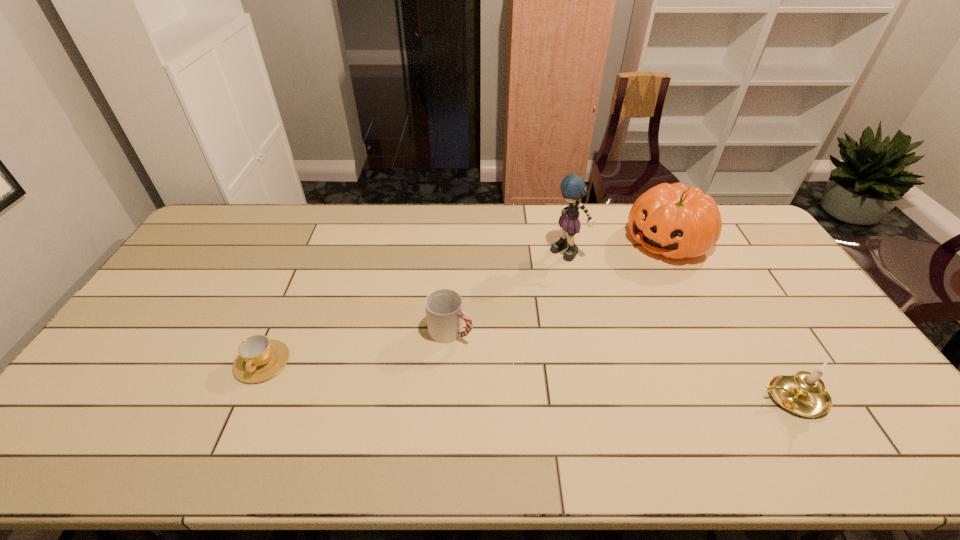
Where is `vacant area at the near right corner of the desktop`? vacant area at the near right corner of the desktop is located at coordinates (833, 395).

Locate an element on the screen. vacant region between the third tallest object and the tallest object is located at coordinates (x=680, y=326).

The height and width of the screenshot is (540, 960). I want to click on vacant region between the fourth tallest object and the third tallest object, so click(621, 364).

This screenshot has width=960, height=540. In order to click on free spot between the shorter cup and the taller cup in this screenshot , I will do `click(356, 346)`.

The width and height of the screenshot is (960, 540). I want to click on free space between the leftmost object and the rag doll, so pyautogui.click(x=415, y=308).

This screenshot has width=960, height=540. In order to click on unoccupied position between the tallest object and the shorter cup in this screenshot , I will do `click(415, 308)`.

Locate an element on the screen. Image resolution: width=960 pixels, height=540 pixels. free space between the third tallest object and the pumpkin is located at coordinates point(730,319).

Locate an element on the screen. This screenshot has height=540, width=960. vacant area that lies between the pumpkin and the candle holder is located at coordinates (730, 319).

I want to click on free space that is in between the third object from left to right and the shortest object, so click(x=415, y=308).

Locate an element on the screen. Image resolution: width=960 pixels, height=540 pixels. vacant region between the left cup and the candle holder is located at coordinates (527, 380).